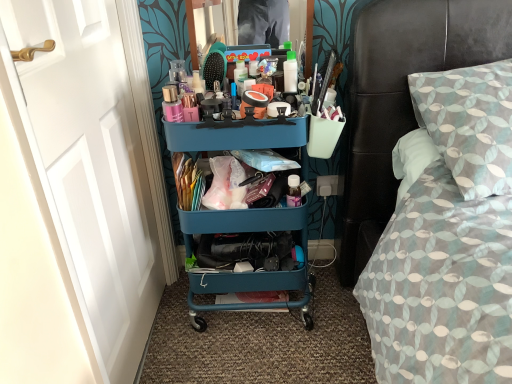
Question: Does white plastic power outlet at lower center lie behind teal plastic cart at center?

Choices:
 (A) yes
 (B) no

Answer: (A)

Question: From a real-world perspective, is white plastic power outlet at lower center over teal plastic cart at center?

Choices:
 (A) yes
 (B) no

Answer: (B)

Question: Is white plastic power outlet at lower center far from teal plastic cart at center?

Choices:
 (A) yes
 (B) no

Answer: (B)

Question: Is white plastic power outlet at lower center turned away from teal plastic cart at center?

Choices:
 (A) no
 (B) yes

Answer: (A)

Question: Is white plastic power outlet at lower center thinner than teal plastic cart at center?

Choices:
 (A) no
 (B) yes

Answer: (B)

Question: Does point (424, 291) appear closer or farther from the camera than point (318, 193)?

Choices:
 (A) farther
 (B) closer

Answer: (B)

Question: Based on their positions, is patterned fabric bed at right located to the left or right of white plastic power outlet at lower center?

Choices:
 (A) left
 (B) right

Answer: (B)

Question: Is patterned fabric bed at right taller or shorter than white plastic power outlet at lower center?

Choices:
 (A) short
 (B) tall

Answer: (B)

Question: Considering the positions of patterned fabric bed at right and white plastic power outlet at lower center in the image, is patterned fabric bed at right bigger or smaller than white plastic power outlet at lower center?

Choices:
 (A) small
 (B) big

Answer: (B)

Question: Is teal plastic cart at center inside the boundaries of white painted wood door at left, or outside?

Choices:
 (A) outside
 (B) inside

Answer: (A)

Question: From the image's perspective, is teal plastic cart at center above or below white painted wood door at left?

Choices:
 (A) above
 (B) below

Answer: (B)

Question: Is point (236, 129) positioned closer to the camera than point (96, 238)?

Choices:
 (A) closer
 (B) farther

Answer: (B)

Question: Looking at the image, does teal plastic cart at center seem bigger or smaller compared to white painted wood door at left?

Choices:
 (A) small
 (B) big

Answer: (B)

Question: Based on their sizes in the image, would you say teal plastic cart at center is bigger or smaller than patterned fabric bed at right?

Choices:
 (A) small
 (B) big

Answer: (A)

Question: From their relative heights in the image, would you say teal plastic cart at center is taller or shorter than patterned fabric bed at right?

Choices:
 (A) short
 (B) tall

Answer: (B)